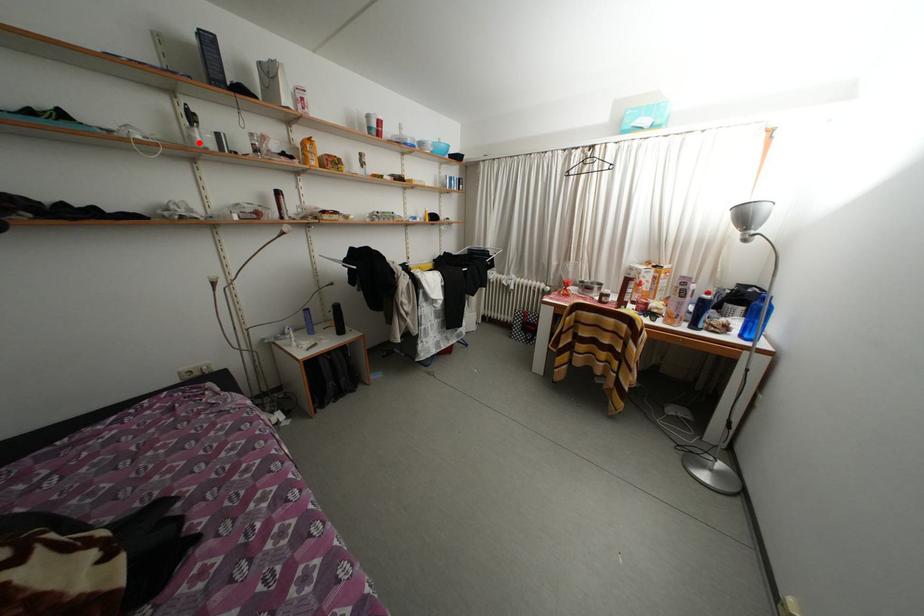
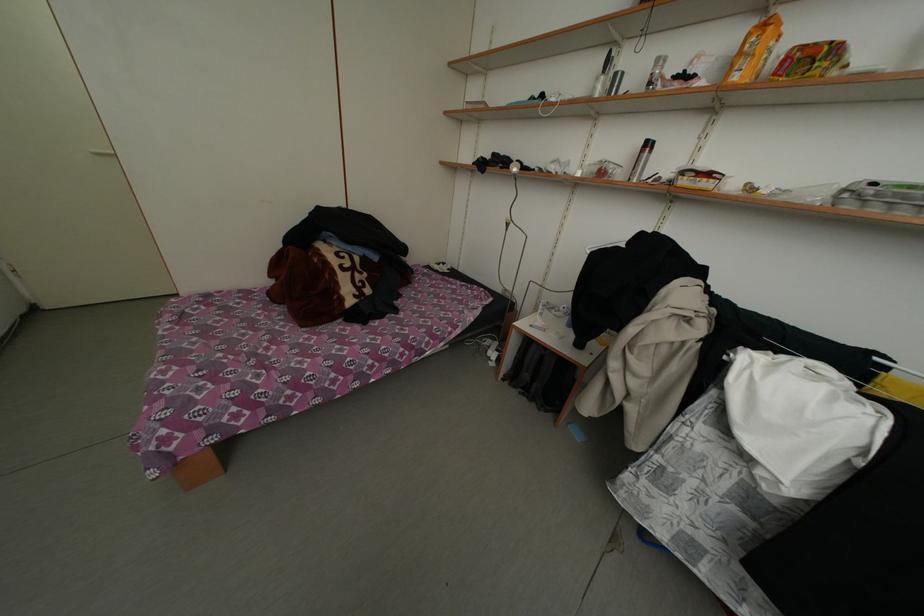
Question: I am providing you with two images of the same scene from different viewpoints. A red point is marked on the first image. At the location where the point appears in image 1, is it still visible in image 2?

Choices:
 (A) Yes
 (B) No

Answer: (A)